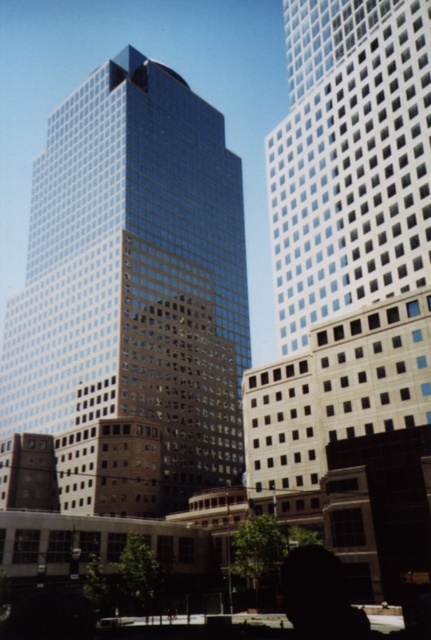
Which is more to the right, glassy reflective skyscraper at center or white glass building at upper right?

Positioned to the right is white glass building at upper right.

Does glassy reflective skyscraper at center have a larger size compared to white glass building at upper right?

Yes.

Based on the photo, who is more distant from viewer, (x=141, y=225) or (x=422, y=45)?

The point (x=141, y=225) is more distant.

Identify the location of glassy reflective skyscraper at center. The width and height of the screenshot is (431, 640). (134, 275).